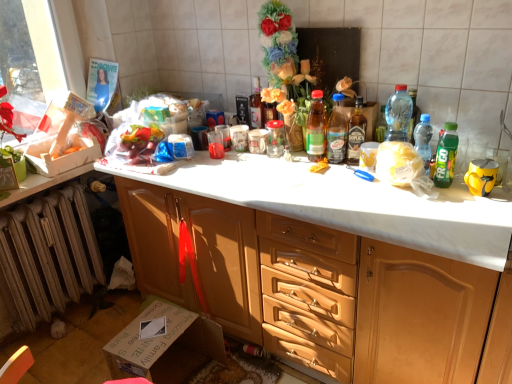
Question: From a real-world perspective, is wooden cabinet at center physically above green plastic bottle at right, which ranks as the 7th bottle in left-to-right order?

Choices:
 (A) no
 (B) yes

Answer: (A)

Question: From the image's perspective, is wooden cabinet at center beneath green plastic bottle at right, which ranks as the 7th bottle in left-to-right order?

Choices:
 (A) no
 (B) yes

Answer: (B)

Question: Is wooden cabinet at center positioned behind green plastic bottle at right, which ranks as the 1th bottle in right-to-left order?

Choices:
 (A) yes
 (B) no

Answer: (B)

Question: Can you confirm if wooden cabinet at center is shorter than green plastic bottle at right, which ranks as the 7th bottle in left-to-right order?

Choices:
 (A) yes
 (B) no

Answer: (B)

Question: From a real-world perspective, is wooden cabinet at center below green plastic bottle at right, which ranks as the 1th bottle in right-to-left order?

Choices:
 (A) yes
 (B) no

Answer: (A)

Question: Is wooden cabinet at center looking in the opposite direction of green plastic bottle at right, which ranks as the 1th bottle in right-to-left order?

Choices:
 (A) no
 (B) yes

Answer: (A)

Question: Is rusty metal radiator at lower left smaller than transparent plastic bottle at right, the 3th bottle in the right-to-left sequence?

Choices:
 (A) no
 (B) yes

Answer: (A)

Question: Does rusty metal radiator at lower left appear on the left side of transparent plastic bottle at right, which is counted as the fifth bottle, starting from the left?

Choices:
 (A) no
 (B) yes

Answer: (B)

Question: Is rusty metal radiator at lower left oriented towards transparent plastic bottle at right, the 3th bottle in the right-to-left sequence?

Choices:
 (A) yes
 (B) no

Answer: (A)

Question: From a real-world perspective, is rusty metal radiator at lower left located beneath transparent plastic bottle at right, which is counted as the fifth bottle, starting from the left?

Choices:
 (A) yes
 (B) no

Answer: (A)

Question: Does rusty metal radiator at lower left come behind transparent plastic bottle at right, which is counted as the fifth bottle, starting from the left?

Choices:
 (A) yes
 (B) no

Answer: (A)

Question: Considering the relative sizes of rusty metal radiator at lower left and transparent plastic bottle at right, which is counted as the fifth bottle, starting from the left, in the image provided, is rusty metal radiator at lower left wider than transparent plastic bottle at right, which is counted as the fifth bottle, starting from the left,?

Choices:
 (A) yes
 (B) no

Answer: (A)

Question: Is translucent plastic bottle at upper right, marked as the sixth bottle in a left-to-right arrangement, oriented towards translucent plastic bottle at center, acting as the second bottle starting from the left?

Choices:
 (A) yes
 (B) no

Answer: (B)